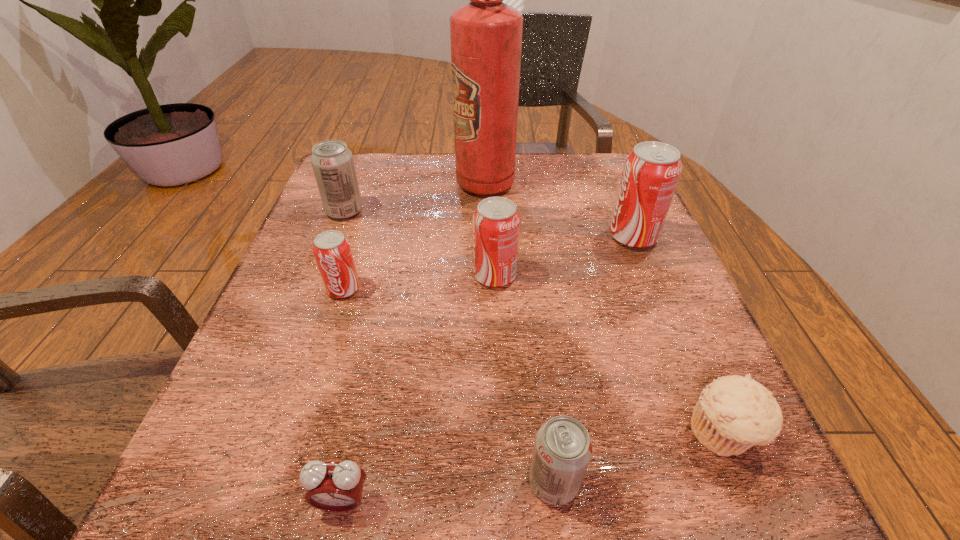
Locate an element on the screen. The width and height of the screenshot is (960, 540). pink alarm clock is located at coordinates (333, 486).

This screenshot has width=960, height=540. I want to click on alarm clock, so click(333, 486).

In order to click on beige muffin in this screenshot , I will do `click(734, 413)`.

Where is `vacant region located on the label side of the fire extinguisher`? The image size is (960, 540). vacant region located on the label side of the fire extinguisher is located at coordinates (432, 183).

Locate an element on the screen. vacant region located on the label side of the fire extinguisher is located at coordinates (391, 183).

This screenshot has width=960, height=540. Find the location of `vacant space situated on the label side of the fire extinguisher`. vacant space situated on the label side of the fire extinguisher is located at coordinates (354, 183).

The width and height of the screenshot is (960, 540). What are the coordinates of `vacant area situated 0.370m on the logo side of the farthest red soda can` in the screenshot? It's located at (432, 237).

This screenshot has height=540, width=960. In order to click on blank space located 0.050m on the logo side of the farthest red soda can in this screenshot , I will do `click(585, 237)`.

Identify the location of free space located on the logo side of the farthest red soda can. The width and height of the screenshot is (960, 540). click(508, 237).

The height and width of the screenshot is (540, 960). I want to click on vacant space positioned on the right of the left gray soda can, so click(x=528, y=211).